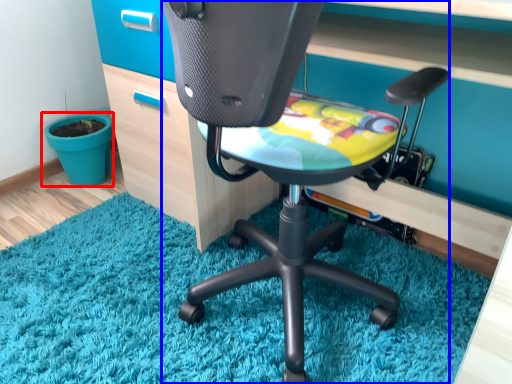
Question: Which of the following is the closest to the observer, flowerpot (highlighted by a red box) or chair (highlighted by a blue box)?

Choices:
 (A) flowerpot
 (B) chair

Answer: (B)